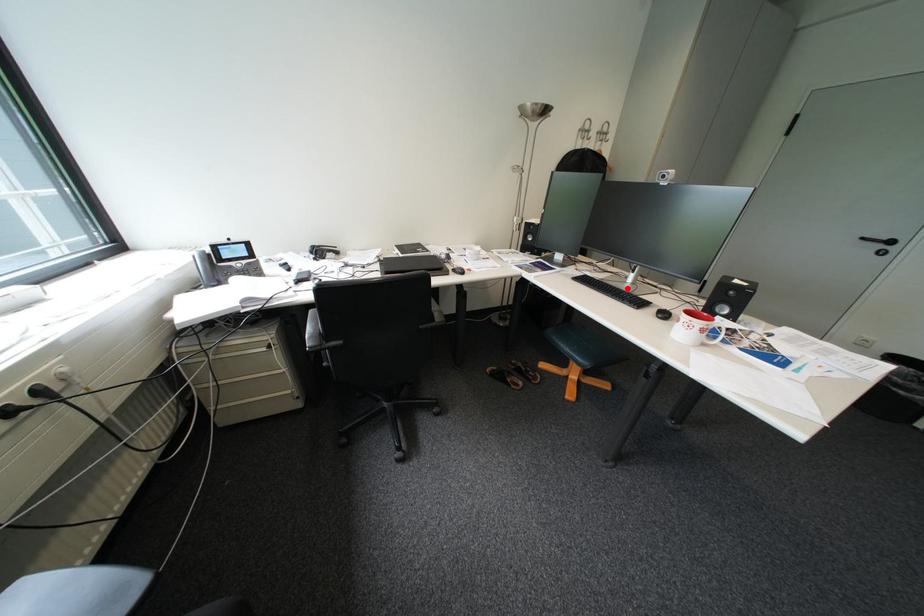
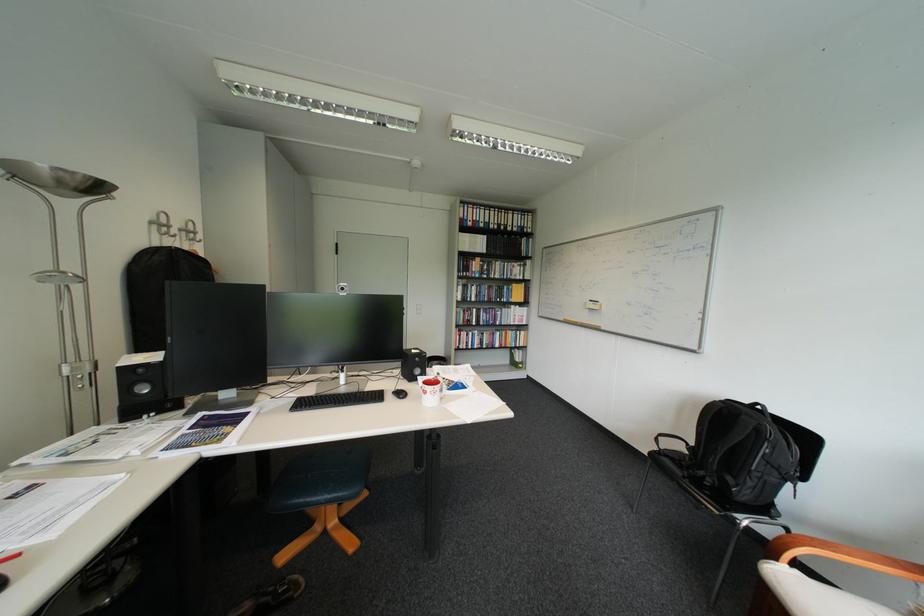
Find the pixel in the second image that matches the highlighted location in the first image.

(357, 394)